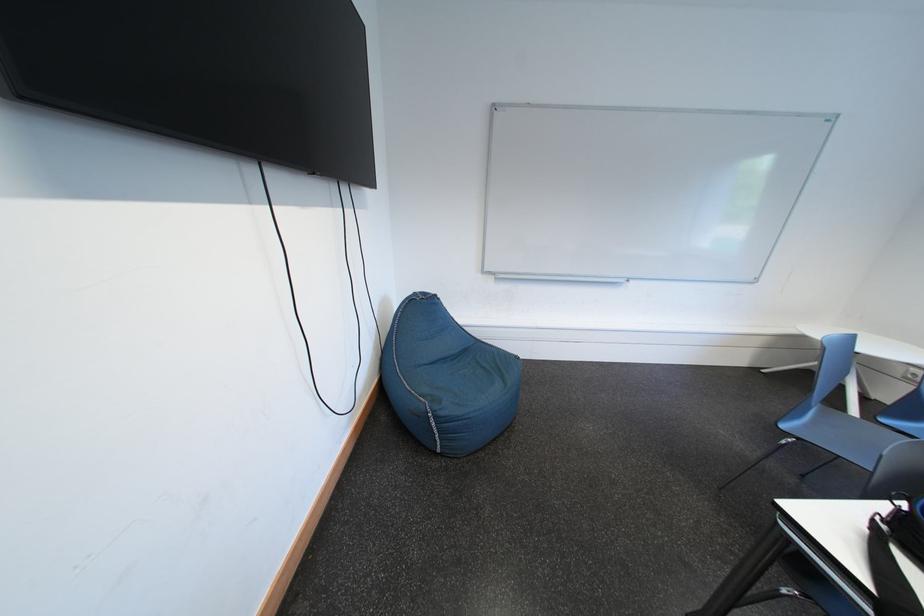
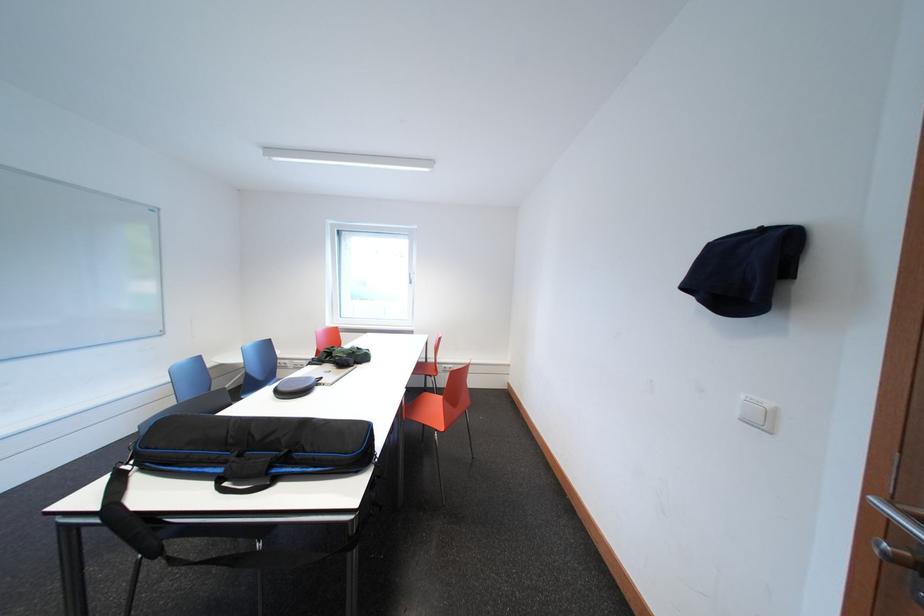
Question: The camera is either moving clockwise (left) or counter-clockwise (right) around the object. The first image is from the beginning of the video and the second image is from the end. Is the camera moving left or right when shooting the video?

Choices:
 (A) Left
 (B) Right

Answer: (A)